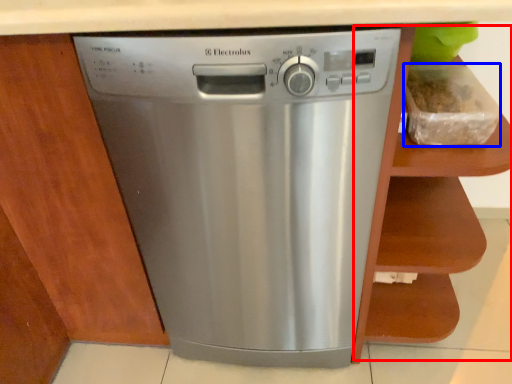
Question: Among these objects, which one is nearest to the camera, cabinet (highlighted by a red box) or food (highlighted by a blue box)?

Choices:
 (A) cabinet
 (B) food

Answer: (A)